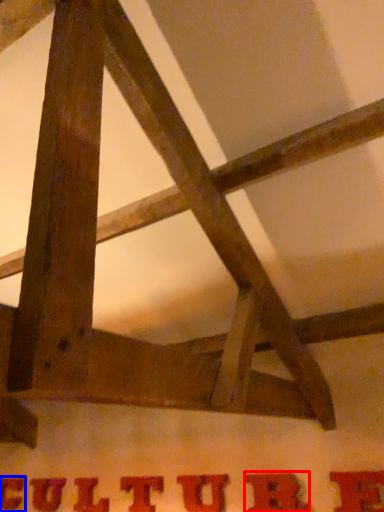
Question: Which point is further to the camera, letter (highlighted by a red box) or letter (highlighted by a blue box)?

Choices:
 (A) letter
 (B) letter

Answer: (B)